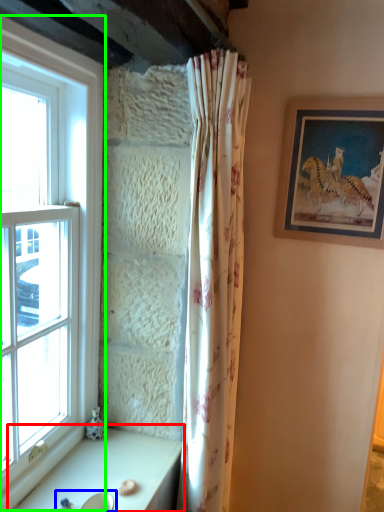
Question: Which object is positioned closest to table (highlighted by a red box)? Select from sink (highlighted by a blue box) and window (highlighted by a green box).

Choices:
 (A) sink
 (B) window

Answer: (A)